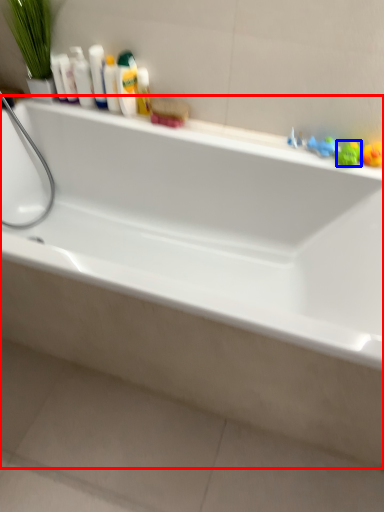
Question: Which of the following is the farthest to the observer, bathtub (highlighted by a red box) or toy (highlighted by a blue box)?

Choices:
 (A) bathtub
 (B) toy

Answer: (B)